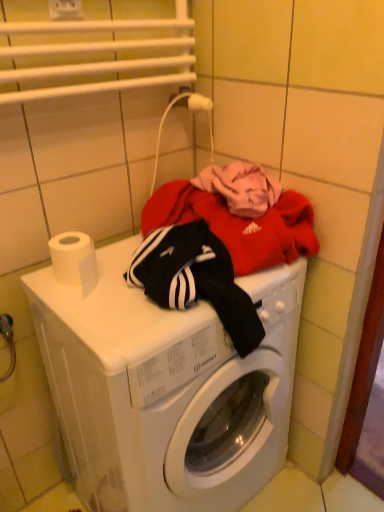
Question: Is white plastic electric outlet at upper center at the left side of white plastic washing machine at center?

Choices:
 (A) no
 (B) yes

Answer: (B)

Question: Is white plastic electric outlet at upper center positioned in front of white plastic washing machine at center?

Choices:
 (A) yes
 (B) no

Answer: (B)

Question: Is white plastic electric outlet at upper center to the right of white plastic washing machine at center from the viewer's perspective?

Choices:
 (A) yes
 (B) no

Answer: (B)

Question: Is white plastic electric outlet at upper center not close to white plastic washing machine at center?

Choices:
 (A) yes
 (B) no

Answer: (B)

Question: Is white plastic electric outlet at upper center wider than white plastic washing machine at center?

Choices:
 (A) yes
 (B) no

Answer: (B)

Question: Is white plastic electric outlet at upper center directly adjacent to white plastic washing machine at center?

Choices:
 (A) yes
 (B) no

Answer: (B)

Question: Would you say white plastic washing machine at center is a long distance from white matte toilet paper at upper left?

Choices:
 (A) yes
 (B) no

Answer: (B)

Question: Considering the relative positions of white plastic washing machine at center and white matte toilet paper at upper left in the image provided, is white plastic washing machine at center to the left of white matte toilet paper at upper left from the viewer's perspective?

Choices:
 (A) no
 (B) yes

Answer: (A)

Question: Is white plastic washing machine at center with white matte toilet paper at upper left?

Choices:
 (A) no
 (B) yes

Answer: (A)

Question: From the image's perspective, is white plastic washing machine at center beneath white matte toilet paper at upper left?

Choices:
 (A) yes
 (B) no

Answer: (A)

Question: Considering the relative sizes of white plastic washing machine at center and white matte toilet paper at upper left in the image provided, is white plastic washing machine at center smaller than white matte toilet paper at upper left?

Choices:
 (A) yes
 (B) no

Answer: (B)

Question: From a real-world perspective, is white plastic washing machine at center located beneath white matte toilet paper at upper left?

Choices:
 (A) yes
 (B) no

Answer: (A)

Question: Is white matte toilet paper at upper left thinner than white plastic washing machine at center?

Choices:
 (A) yes
 (B) no

Answer: (A)